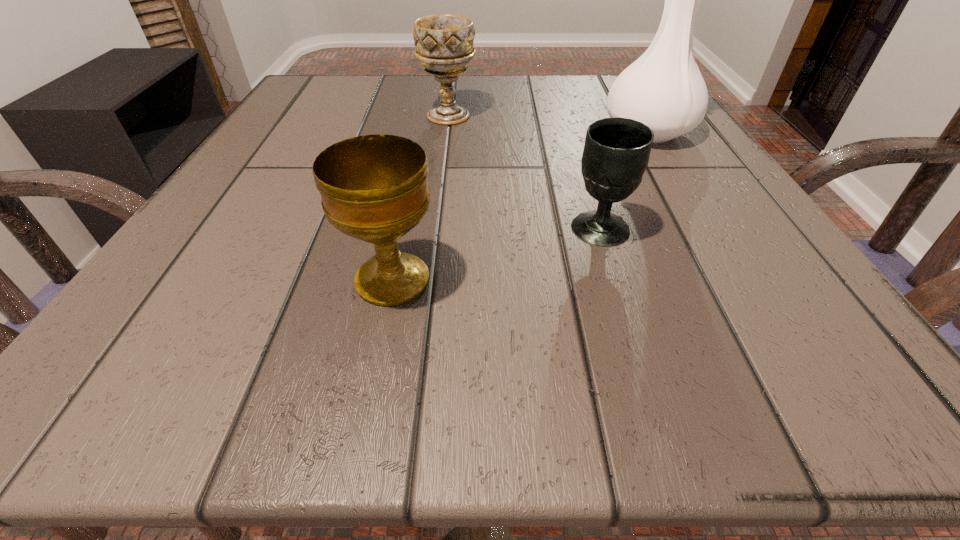
At what (x,y) coordinates should I click in order to perform the action: click on the rightmost object. Please return your answer as a coordinate pair (x, y). Image resolution: width=960 pixels, height=540 pixels. Looking at the image, I should click on pyautogui.click(x=663, y=89).

Where is `vase`? The width and height of the screenshot is (960, 540). vase is located at coordinates (663, 89).

The image size is (960, 540). In order to click on the farthest chalice in this screenshot , I will do `click(444, 43)`.

You are a GUI agent. You are given a task and a screenshot of the screen. Output one action in this format:
    pyautogui.click(x=<x>, y=<y>)
    Task: Click on the nearest object
    
    Given the screenshot: What is the action you would take?
    pyautogui.click(x=374, y=188)

Locate an element on the screen. The width and height of the screenshot is (960, 540). the rightmost chalice is located at coordinates (616, 153).

Identify the location of the second nearest object. This screenshot has height=540, width=960. (616, 153).

This screenshot has width=960, height=540. Identify the location of free space located 0.260m on the front of the rightmost object. (723, 257).

I want to click on vacant region located on the right of the farthest chalice, so click(x=669, y=116).

I want to click on vacant region located on the left of the nearest object, so click(220, 280).

At what (x,y) coordinates should I click in order to perform the action: click on free space located 0.200m on the left of the third farthest object. Please return your answer as a coordinate pair (x, y). This screenshot has height=540, width=960. Looking at the image, I should click on (420, 229).